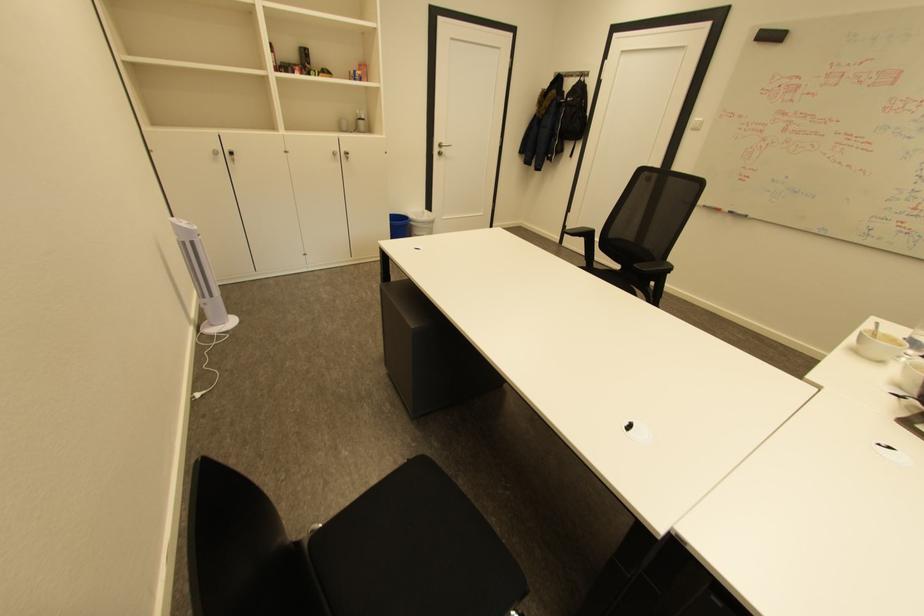
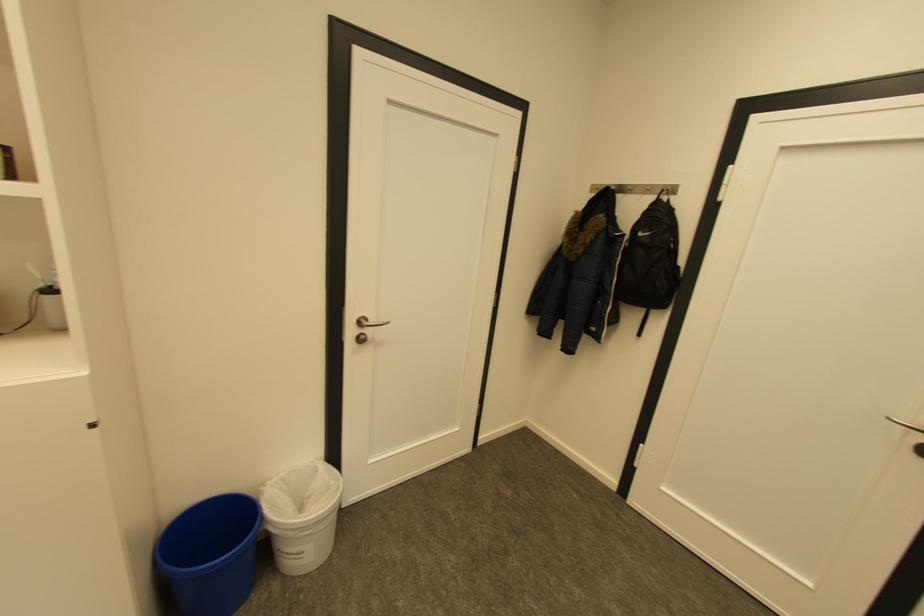
Where in the second image is the point corresponding to the point at 446,146 from the first image?

(367, 323)